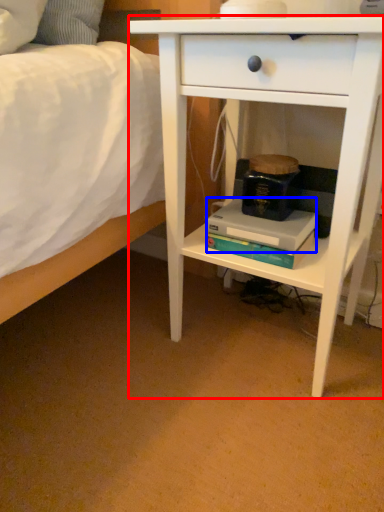
Question: Which point is further to the camera, nightstand (highlighted by a red box) or paperback book (highlighted by a blue box)?

Choices:
 (A) nightstand
 (B) paperback book

Answer: (B)